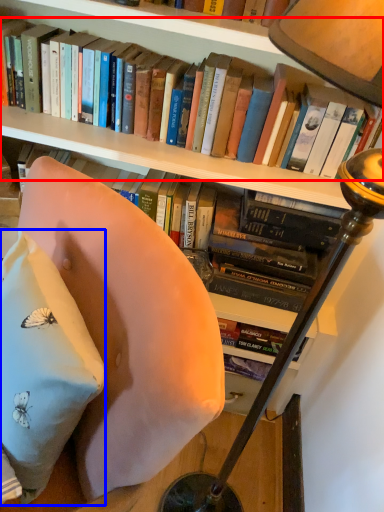
Question: Which object appears farthest to the camera in this image, book (highlighted by a red box) or pillow (highlighted by a blue box)?

Choices:
 (A) book
 (B) pillow

Answer: (A)